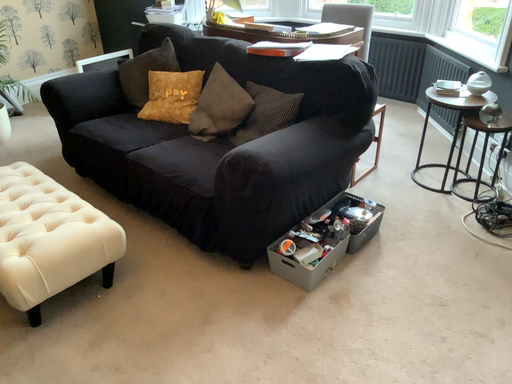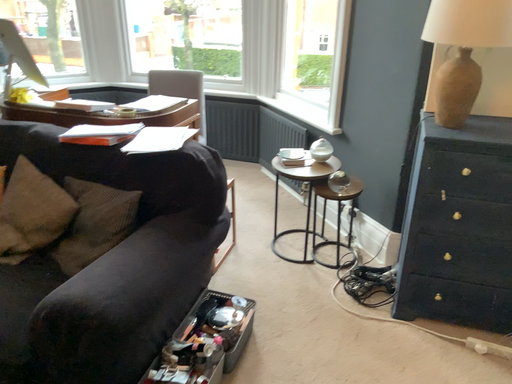
Question: How did the camera likely rotate when shooting the video?

Choices:
 (A) rotated right
 (B) rotated left

Answer: (A)